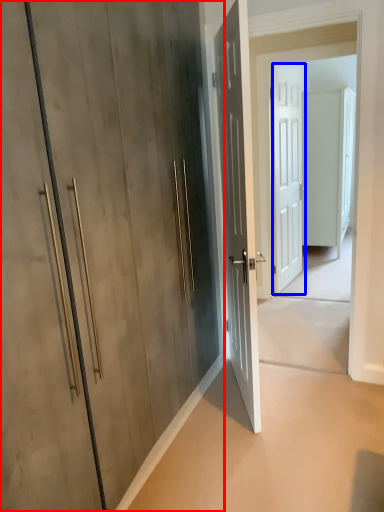
Question: Which object is closer to the camera taking this photo, door (highlighted by a red box) or door (highlighted by a blue box)?

Choices:
 (A) door
 (B) door

Answer: (A)